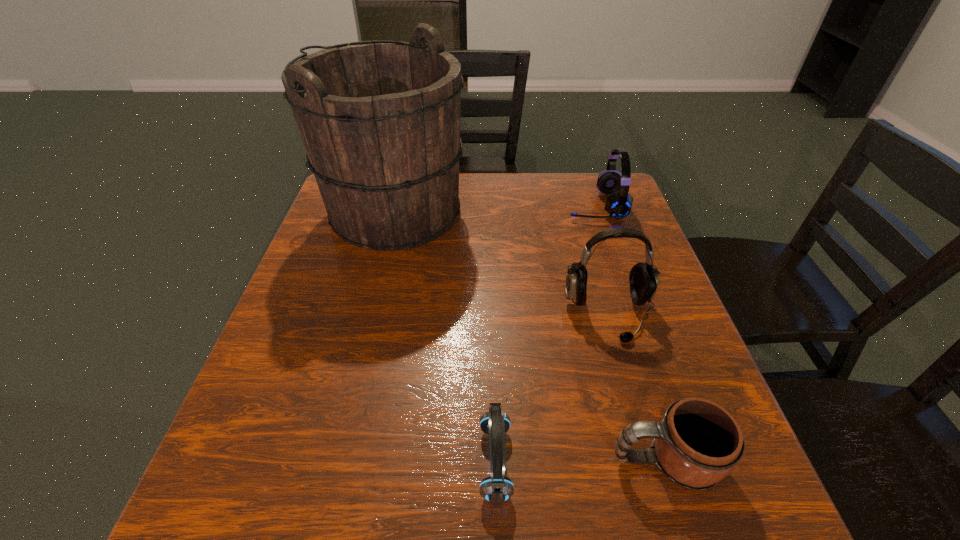
This screenshot has height=540, width=960. In the image, there is a desktop. What are the coordinates of `blank space at the near edge` in the screenshot? It's located at (324, 521).

In the image, there is a desktop. Identify the location of free space at the left edge. This screenshot has width=960, height=540. (343, 267).

Image resolution: width=960 pixels, height=540 pixels. Identify the location of free space that is in between the second object from left to right and the tallest object. pyautogui.click(x=445, y=337).

The width and height of the screenshot is (960, 540). In order to click on vacant space that's between the tallest headset and the second shortest headset in this screenshot , I will do `click(602, 260)`.

Locate an element on the screen. The height and width of the screenshot is (540, 960). vacant area that lies between the shortest headset and the mug is located at coordinates (580, 461).

This screenshot has width=960, height=540. Find the location of `empty location between the shortest headset and the mug`. empty location between the shortest headset and the mug is located at coordinates (580, 461).

I want to click on vacant space that's between the leftmost headset and the third farthest object, so click(552, 389).

Locate an element on the screen. This screenshot has width=960, height=540. free spot between the second nearest headset and the leftmost object is located at coordinates (502, 264).

Find the location of a particular element. The height and width of the screenshot is (540, 960). free spot between the leftmost object and the leftmost headset is located at coordinates (445, 337).

Where is `free space between the second nearest headset and the third shortest object`? The image size is (960, 540). free space between the second nearest headset and the third shortest object is located at coordinates (602, 260).